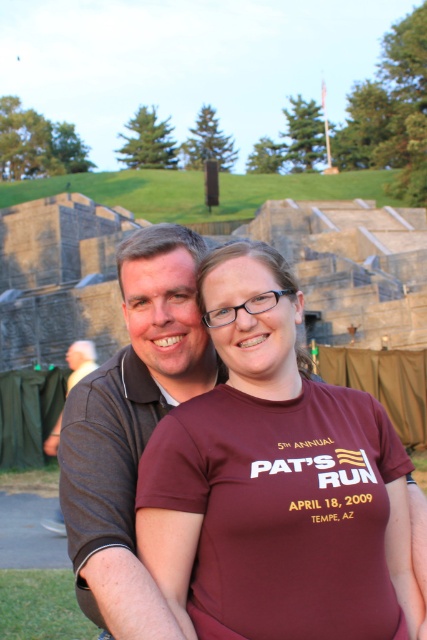
Question: Which object appears farthest from the camera in this image?

Choices:
 (A) brown fabric shirt at left
 (B) maroon t-shirt at center
 (C) dark gray polo shirt at center

Answer: (A)

Question: Is maroon t-shirt at center thinner than brown fabric shirt at left?

Choices:
 (A) yes
 (B) no

Answer: (B)

Question: Among these points, which one is nearest to the camera?

Choices:
 (A) (199, 381)
 (B) (98, 365)

Answer: (A)

Question: Does maroon t-shirt at center lie in front of brown fabric shirt at left?

Choices:
 (A) yes
 (B) no

Answer: (A)

Question: Can you confirm if maroon t-shirt at center is positioned to the right of brown fabric shirt at left?

Choices:
 (A) no
 (B) yes

Answer: (B)

Question: Which object is closer to the camera taking this photo?

Choices:
 (A) dark gray polo shirt at center
 (B) maroon t-shirt at center

Answer: (A)